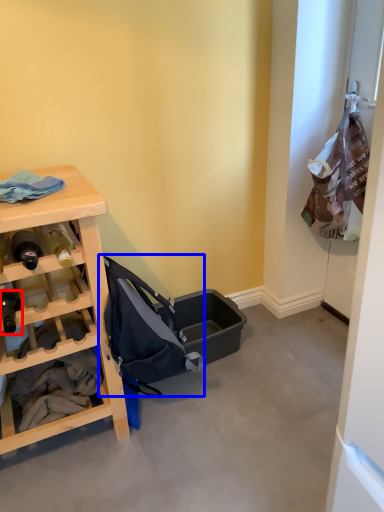
Question: Which point is further to the camera, bottle (highlighted by a red box) or baby carriage (highlighted by a blue box)?

Choices:
 (A) bottle
 (B) baby carriage

Answer: (B)